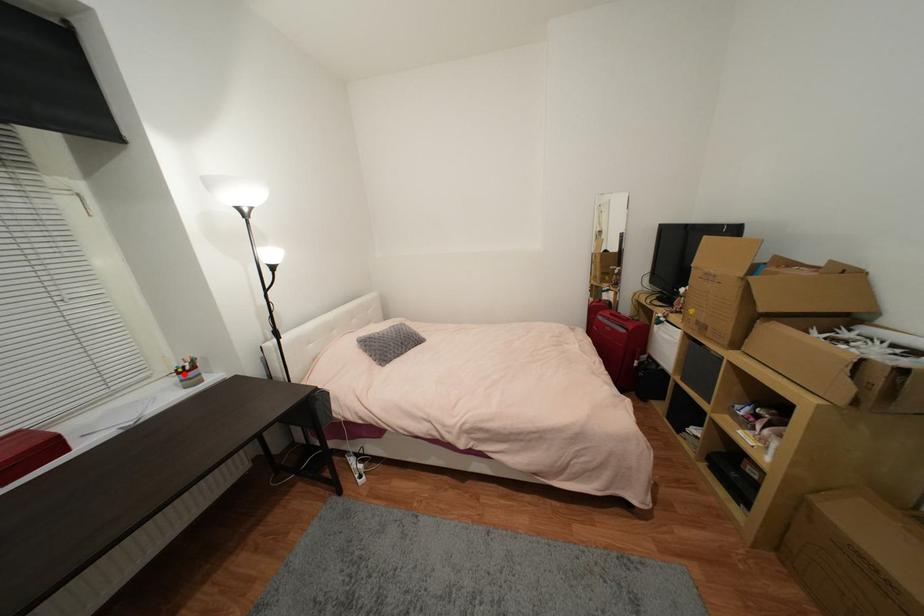
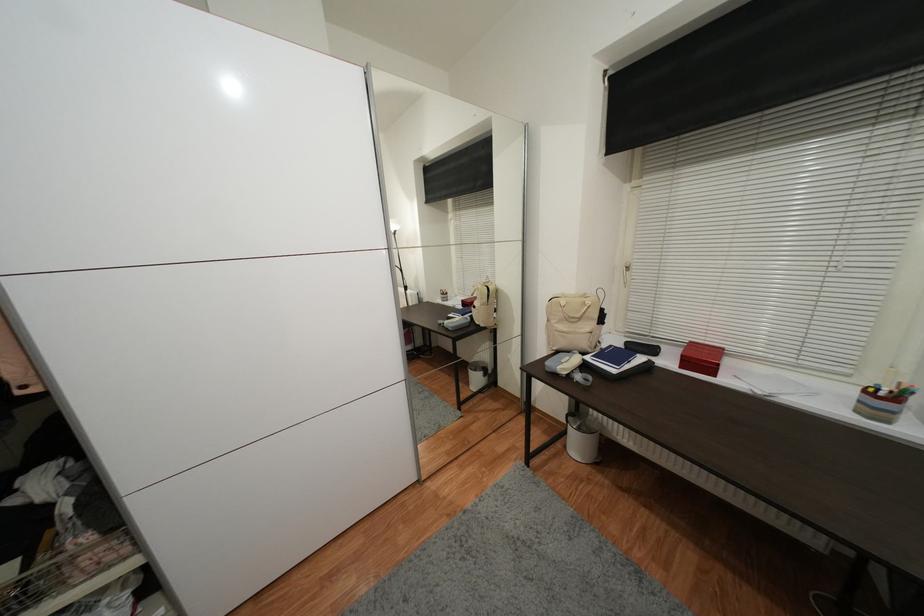
Question: I am providing you with two images of the same scene from different viewpoints. Given a red point in image1, look at the same physical point in image2. Is it:

Choices:
 (A) Closer to the viewpoint
 (B) Farther from the viewpoint

Answer: (B)